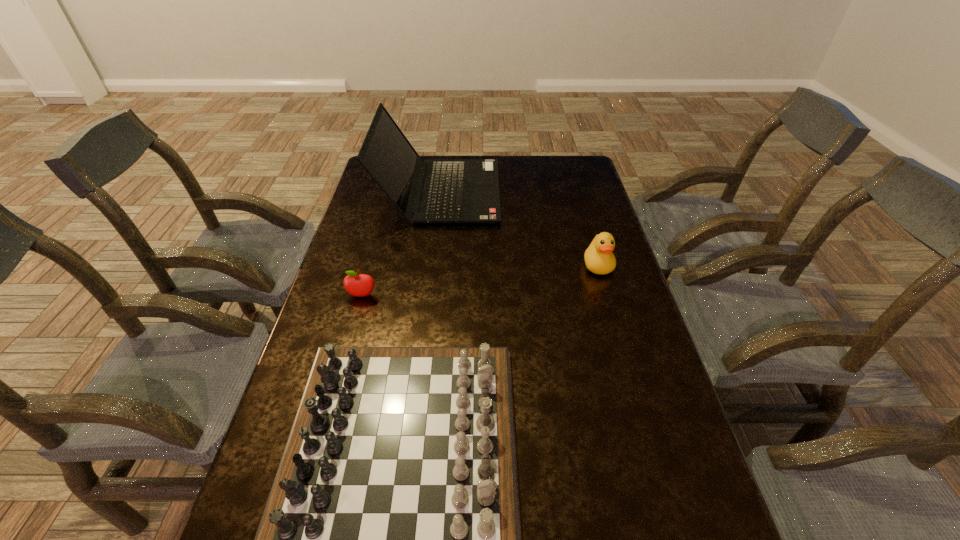
Locate an element on the screen. This screenshot has width=960, height=540. free space between the shortest object and the laptop computer is located at coordinates (401, 244).

This screenshot has height=540, width=960. I want to click on vacant area between the second farthest object and the second nearest object, so click(480, 280).

Where is `empty space that is in between the duck and the shortest object`? The width and height of the screenshot is (960, 540). empty space that is in between the duck and the shortest object is located at coordinates (480, 280).

Identify the location of free space between the duck and the apple. The image size is (960, 540). (480, 280).

I want to click on free space between the rightmost object and the farthest object, so click(x=518, y=228).

This screenshot has width=960, height=540. In order to click on object that is the second nearest to the tallest object in this screenshot , I will do `click(359, 285)`.

I want to click on the third closest object to the second farthest object, so 359,285.